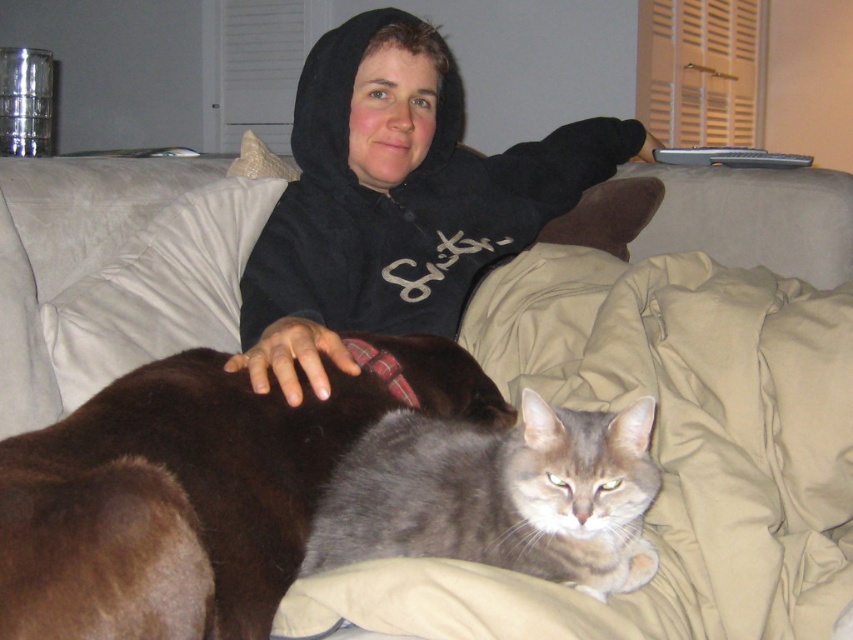
Can you confirm if black hoodie at upper center is thinner than gray fur cat at center?

In fact, black hoodie at upper center might be wider than gray fur cat at center.

Is black hoodie at upper center positioned behind gray fur cat at center?

That is True.

Identify the location of black hoodie at upper center. This screenshot has height=640, width=853. (405, 200).

Does brown fur cat at center appear on the right side of gray fur cat at center?

Incorrect, brown fur cat at center is not on the right side of gray fur cat at center.

Is brown fur cat at center bigger than gray fur cat at center?

Yes, brown fur cat at center is bigger than gray fur cat at center.

Who is more forward, (138, 403) or (466, 451)?

Positioned in front is point (138, 403).

Locate an element on the screen. The width and height of the screenshot is (853, 640). brown fur cat at center is located at coordinates (195, 490).

Is brown fur cat at center wider than black hoodie at upper center?

No, brown fur cat at center is not wider than black hoodie at upper center.

Can you confirm if brown fur cat at center is shorter than black hoodie at upper center?

Correct, brown fur cat at center is not as tall as black hoodie at upper center.

Does point (184, 524) lie behind point (375, 269)?

No.

Identify the location of brown fur cat at center. This screenshot has height=640, width=853. (195, 490).